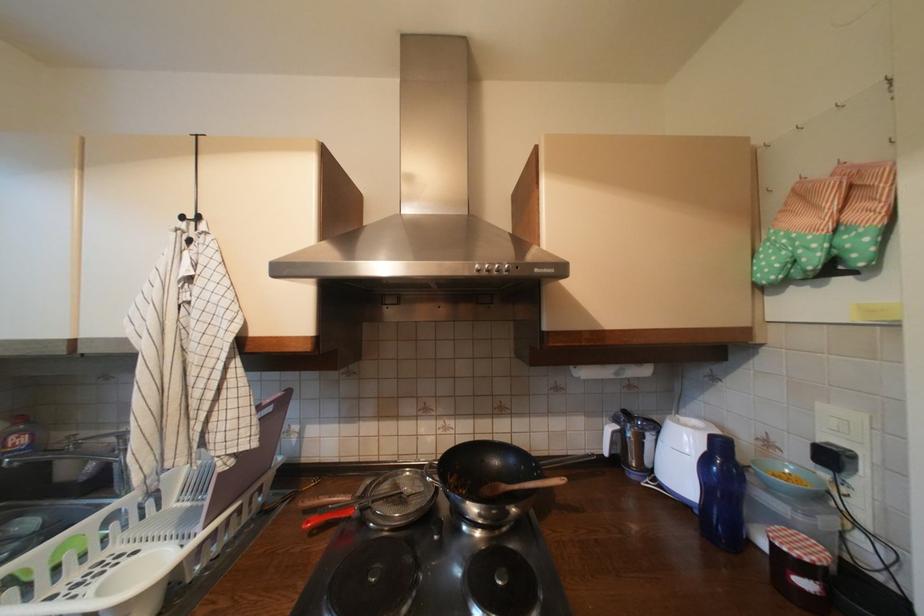
Find where to lift the strainer handle. Please return your answer as a coordinate pair (x, y).

(320, 521)